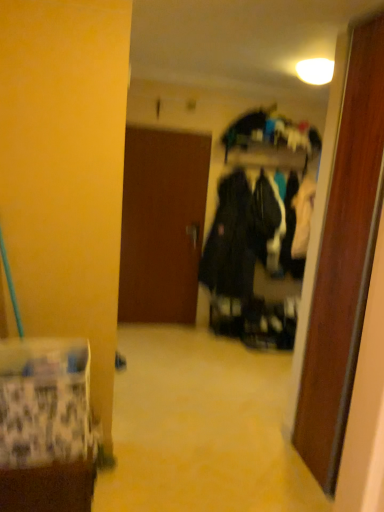
This screenshot has height=512, width=384. I want to click on brown matte door at center, so click(162, 225).

Describe the element at coordinates (162, 225) in the screenshot. The image size is (384, 512). I see `brown matte door at center` at that location.

The image size is (384, 512). Describe the element at coordinates (45, 426) in the screenshot. I see `patterned fabric bag at lower left` at that location.

You are a GUI agent. You are given a task and a screenshot of the screen. Output one action in this format:
    pyautogui.click(x=<x>, y=<y>)
    Task: Click on the patterned fabric bag at lower left
    
    Given the screenshot: What is the action you would take?
    coord(45,426)

What are the coordinates of `brown matte door at center` in the screenshot? It's located at (162, 225).

Can you confirm if brown matte door at center is positioned to the left of patterned fabric bag at lower left?

Incorrect, brown matte door at center is not on the left side of patterned fabric bag at lower left.

Which is in front, brown matte door at center or patterned fabric bag at lower left?

patterned fabric bag at lower left.

Is point (134, 133) closer or farther from the camera than point (43, 371)?

Point (134, 133).

From the image's perspective, relative to patterned fabric bag at lower left, is brown matte door at center above or below?

Clearly, from the image's perspective, brown matte door at center is above patterned fabric bag at lower left.

Consider the image. From a real-world perspective, is brown matte door at center over patterned fabric bag at lower left?

Yes, from a real-world perspective, brown matte door at center is on top of patterned fabric bag at lower left.

Considering the sizes of objects brown matte door at center and patterned fabric bag at lower left in the image provided, who is thinner, brown matte door at center or patterned fabric bag at lower left?

brown matte door at center is thinner.

Is brown matte door at center taller or shorter than patterned fabric bag at lower left?

Clearly, brown matte door at center is taller compared to patterned fabric bag at lower left.

Is brown matte door at center bigger than patterned fabric bag at lower left?

Correct, brown matte door at center is larger in size than patterned fabric bag at lower left.

Is brown matte door at center inside or outside of patterned fabric bag at lower left?

brown matte door at center is located beyond the bounds of patterned fabric bag at lower left.

Are brown matte door at center and patterned fabric bag at lower left located far from each other?

brown matte door at center is positioned a significant distance from patterned fabric bag at lower left.

Does brown matte door at center turn towards patterned fabric bag at lower left?

Yes, brown matte door at center is oriented towards patterned fabric bag at lower left.

I want to click on furniture in front of the brown matte door at center, so 45,426.

Considering the positions of objects patterned fabric bag at lower left and brown matte door at center in the image provided, who is more to the right, patterned fabric bag at lower left or brown matte door at center?

brown matte door at center is more to the right.

Is patterned fabric bag at lower left in front of brown matte door at center?

Yes, patterned fabric bag at lower left is closer to the camera.

Looking at this image, which is closer, (4,422) or (136,237)?

Point (4,422).

From the image's perspective, which is below, patterned fabric bag at lower left or brown matte door at center?

patterned fabric bag at lower left appears lower in the image.

From a real-world perspective, is patterned fabric bag at lower left physically located above or below brown matte door at center?

Clearly, from a real-world perspective, patterned fabric bag at lower left is below brown matte door at center.

Is patterned fabric bag at lower left wider than brown matte door at center?

Correct, the width of patterned fabric bag at lower left exceeds that of brown matte door at center.

Is patterned fabric bag at lower left shorter than brown matte door at center?

Indeed, patterned fabric bag at lower left has a lesser height compared to brown matte door at center.

Does patterned fabric bag at lower left have a smaller size compared to brown matte door at center?

Yes, patterned fabric bag at lower left is smaller than brown matte door at center.

Would you say brown matte door at center is part of patterned fabric bag at lower left's contents?

No, patterned fabric bag at lower left does not contain brown matte door at center.

Is patterned fabric bag at lower left beside brown matte door at center?

No, patterned fabric bag at lower left is not beside brown matte door at center.

Is patterned fabric bag at lower left aimed at brown matte door at center?

No, patterned fabric bag at lower left is not turned towards brown matte door at center.

Can you tell me how much patterned fabric bag at lower left and brown matte door at center differ in facing direction?

91.3 degrees.

Where is `door that is behind the patterned fabric bag at lower left`? door that is behind the patterned fabric bag at lower left is located at coordinates (162, 225).

Where is `furniture in front of the brown matte door at center`? furniture in front of the brown matte door at center is located at coordinates (45, 426).

Identify the location of furniture below the brown matte door at center (from the image's perspective). (45, 426).